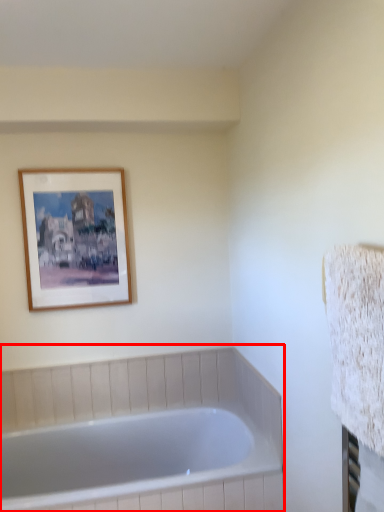
Question: Considering the relative positions of bathtub (annotated by the red box) and picture frame in the image provided, where is bathtub (annotated by the red box) located with respect to the staircase?

Choices:
 (A) left
 (B) right

Answer: (B)